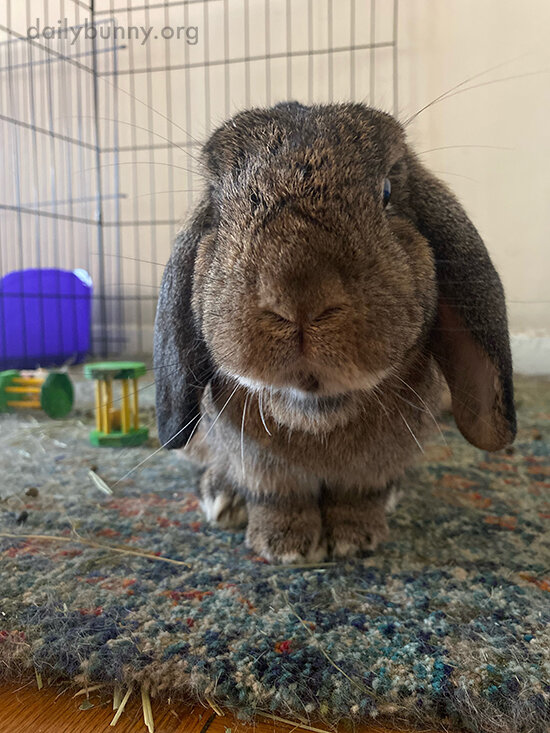
Where is `carpet`? The image size is (550, 733). carpet is located at coordinates (194, 604).